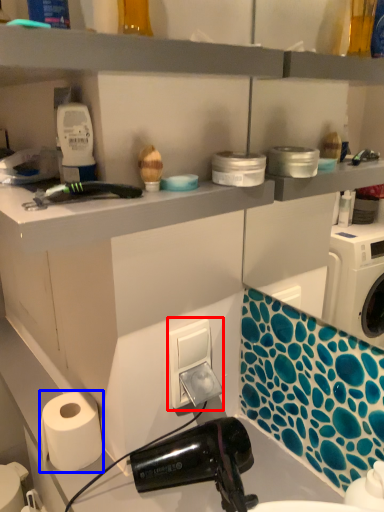
Question: Which object is closer to the camera taking this photo, electric outlet (highlighted by a red box) or paper towel (highlighted by a blue box)?

Choices:
 (A) electric outlet
 (B) paper towel

Answer: (B)